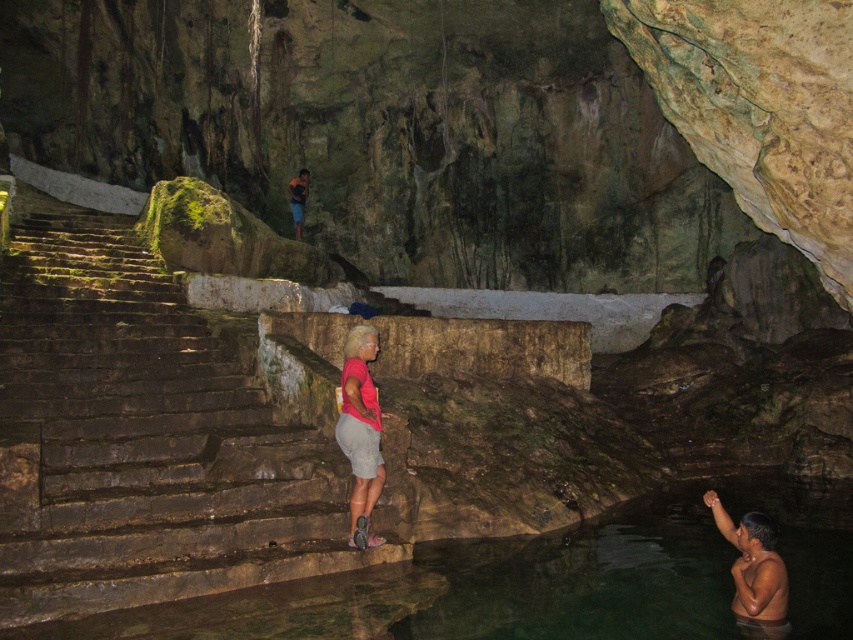
You are standing at the top of the stone steps leading into the cave. You notice the clear water at edge bottom and the pink fabric shorts at center. Which object is closer to your current position?

The pink fabric shorts at center is closer to your current position because the clear water at edge bottom is positioned under it, meaning the water is further down the steps towards the pool.

You are standing at the entrance of the cave and want to approach the clear water at edge bottom. However, there is a smooth skin man at lower right in your path. Which direction should you move to avoid him and reach the water?

To reach the clear water at edge bottom while avoiding the smooth skin man at lower right, you should move to the left. Since the clear water is closer to you than the man, adjusting your path to the left would allow you to navigate around him and access the water.

You are standing at the top of the stone steps leading into the cave. You see the clear water at edge bottom and the pink fabric shorts at center. Which object is closer to you?

The pink fabric shorts at center is closer to you than the clear water at edge bottom because the water is at the edge bottom, which is further down the steps.